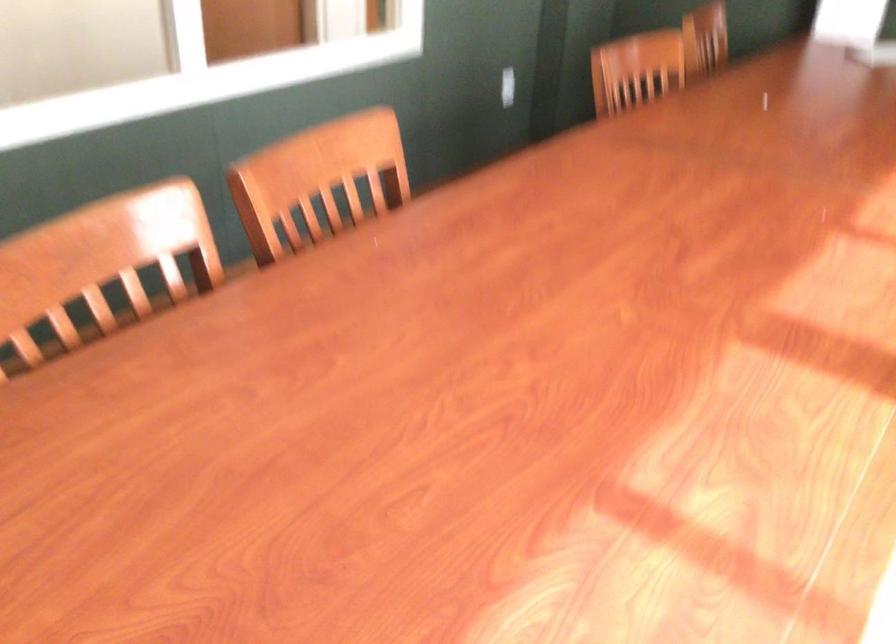
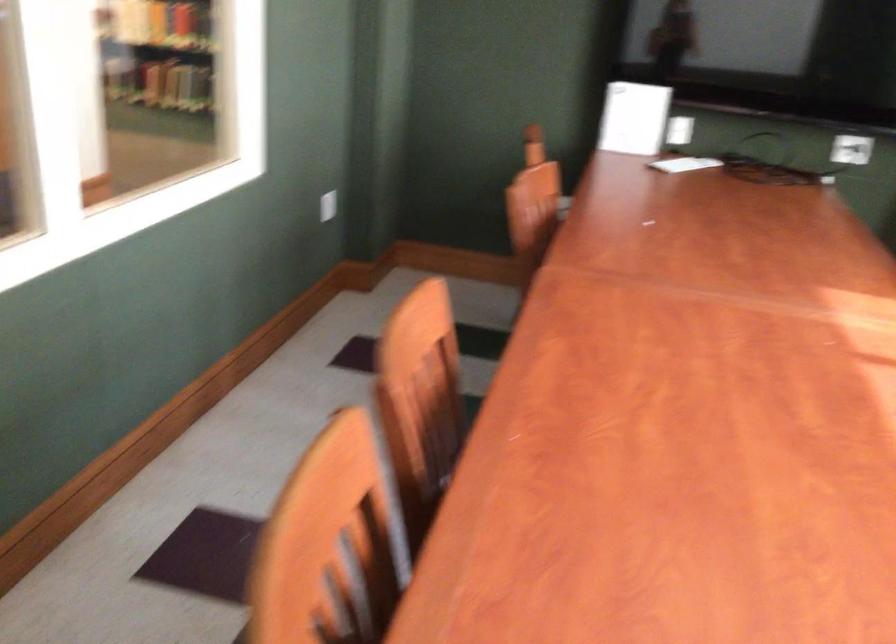
Question: How did the camera likely rotate?

Choices:
 (A) Left
 (B) Right
 (C) Up
 (D) Down

Answer: (B)